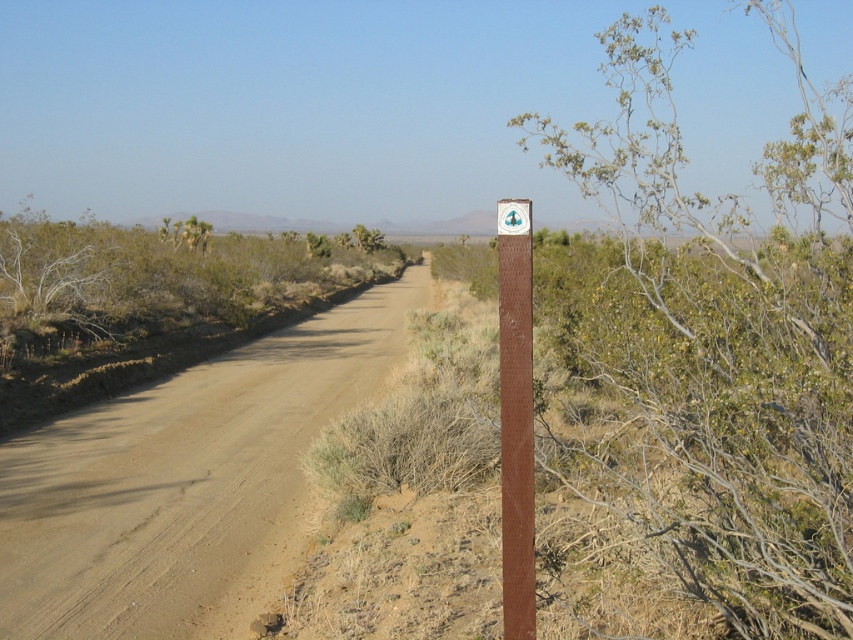
You are standing in the desert and see the brown wooden post at center. If you want to place a 3 meter long fence that starts from your current position and extends towards the post, will the fence reach the post?

The brown wooden post at center is 3.19 meters away from you. Since the fence is 3 meters long, it will not reach the post as the distance is slightly longer than the fence.